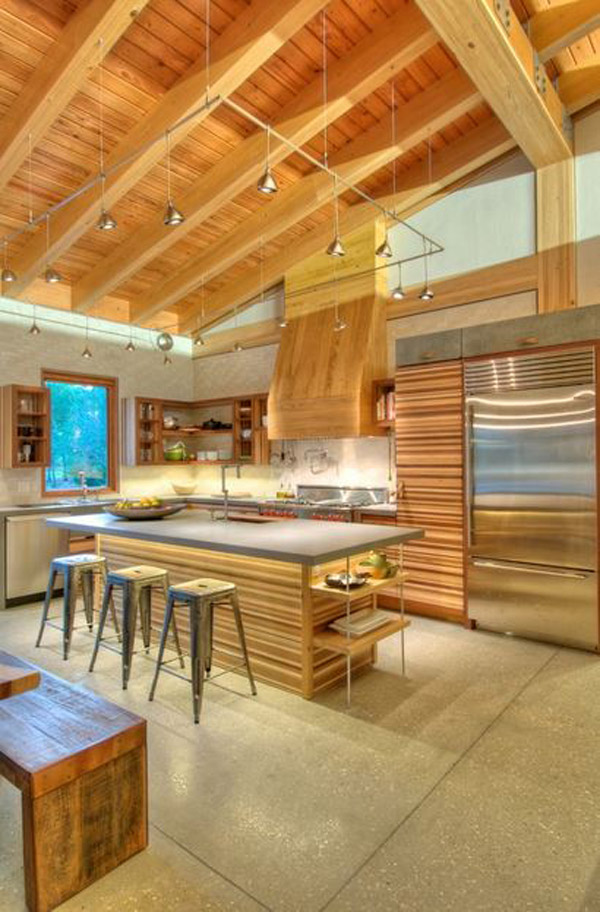
At what (x,y) coordinates should I click in order to perform the action: click on refrigerator. Please return your answer as a coordinate pair (x, y). Looking at the image, I should click on (531, 484).